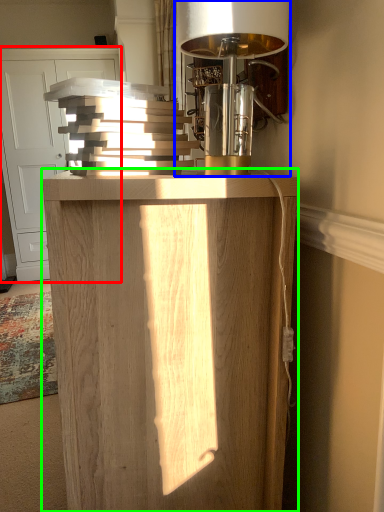
Question: Estimate the real-world distances between objects in this image. Which object is closer to cabinetry (highlighted by a red box), table lamp (highlighted by a blue box) or furniture (highlighted by a green box)?

Choices:
 (A) table lamp
 (B) furniture

Answer: (A)